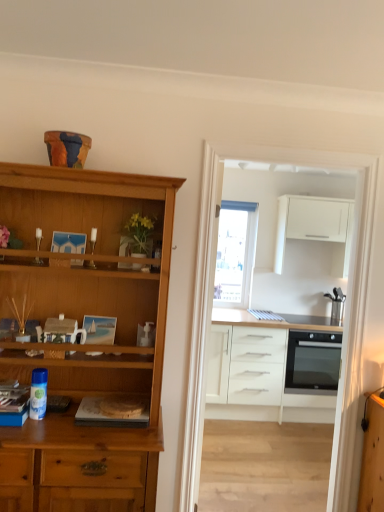
Question: From a real-world perspective, is matte wooden picture frame at center on top of white glossy cabinets at center?

Choices:
 (A) yes
 (B) no

Answer: (B)

Question: Is matte wooden picture frame at center not inside white glossy cabinets at center?

Choices:
 (A) yes
 (B) no

Answer: (A)

Question: Is matte wooden picture frame at center taller than white glossy cabinets at center?

Choices:
 (A) yes
 (B) no

Answer: (B)

Question: From the image's perspective, is matte wooden picture frame at center located beneath white glossy cabinets at center?

Choices:
 (A) yes
 (B) no

Answer: (B)

Question: Is matte wooden picture frame at center oriented towards white glossy cabinets at center?

Choices:
 (A) yes
 (B) no

Answer: (B)

Question: Is matte wooden picture frame at center in contact with white glossy cabinets at center?

Choices:
 (A) yes
 (B) no

Answer: (B)

Question: From a real-world perspective, is white glossy cabinets at center physically above white matte cabinet at upper right, arranged as the 1th cabinetry when viewed from the top?

Choices:
 (A) no
 (B) yes

Answer: (A)

Question: Considering the relative positions of white glossy cabinets at center and white matte cabinet at upper right, acting as the second cabinetry starting from the bottom, in the image provided, is white glossy cabinets at center to the right of white matte cabinet at upper right, acting as the second cabinetry starting from the bottom, from the viewer's perspective?

Choices:
 (A) no
 (B) yes

Answer: (A)

Question: Considering the relative sizes of white glossy cabinets at center and white matte cabinet at upper right, arranged as the 1th cabinetry when viewed from the top, in the image provided, is white glossy cabinets at center smaller than white matte cabinet at upper right, arranged as the 1th cabinetry when viewed from the top,?

Choices:
 (A) no
 (B) yes

Answer: (B)

Question: Does white glossy cabinets at center have a lesser height compared to white matte cabinet at upper right, acting as the second cabinetry starting from the bottom?

Choices:
 (A) no
 (B) yes

Answer: (A)

Question: Can you confirm if white glossy cabinets at center is wider than white matte cabinet at upper right, acting as the second cabinetry starting from the bottom?

Choices:
 (A) yes
 (B) no

Answer: (B)

Question: Is white matte cabinet at upper right, acting as the second cabinetry starting from the bottom, at the back of white glossy cabinets at center?

Choices:
 (A) yes
 (B) no

Answer: (B)

Question: Does matte wooden picture frame at center appear on the right side of transparent glass window at center?

Choices:
 (A) yes
 (B) no

Answer: (B)